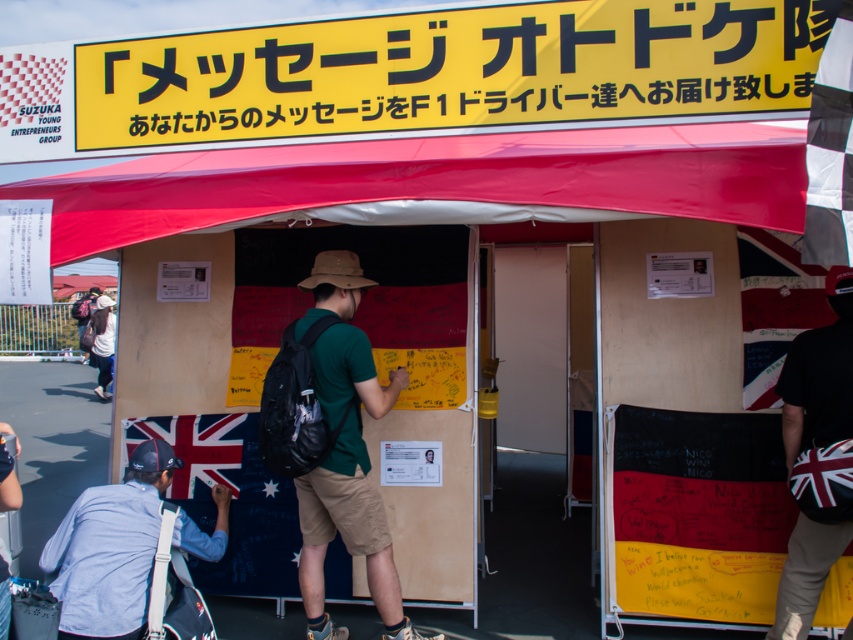
Between point (112, 497) and point (840, 404), which one is positioned in front?

Point (840, 404)

Which of these two, white shirt at lower left or british flag-patterned fanny pack at center, stands shorter?

white shirt at lower left is shorter.

Locate an element on the screen. This screenshot has width=853, height=640. white shirt at lower left is located at coordinates (109, 548).

Can you confirm if wooden bulletin board at center is shorter than british flag-patterned fanny pack at center?

No.

Who is more forward, (415, 541) or (793, 573)?

Point (793, 573)

Where is `wooden bulletin board at center`? wooden bulletin board at center is located at coordinates [x=322, y=339].

Is wooden bulletin board at center thinner than green matte shirt at center?

No.

Which is behind, point (300, 316) or point (347, 374)?

The point (300, 316) is more distant.

Does point (120, 400) come closer to viewer compared to point (323, 403)?

No, (120, 400) is behind (323, 403).

Image resolution: width=853 pixels, height=640 pixels. Identify the location of wooden bulletin board at center. (322, 339).